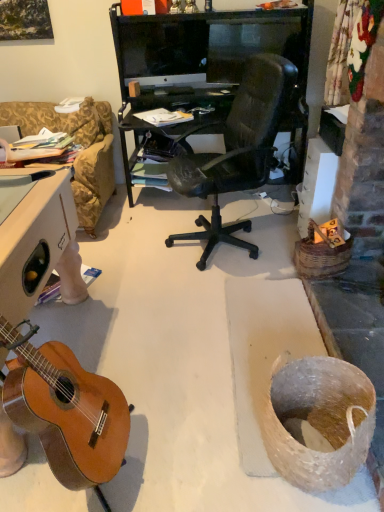
Question: From a real-world perspective, is matte black monitor at upper center on natural wood guitar at lower left?

Choices:
 (A) no
 (B) yes

Answer: (B)

Question: Does matte black monitor at upper center have a greater width compared to natural wood guitar at lower left?

Choices:
 (A) yes
 (B) no

Answer: (B)

Question: Can you confirm if matte black monitor at upper center is taller than natural wood guitar at lower left?

Choices:
 (A) yes
 (B) no

Answer: (B)

Question: Would you say matte black monitor at upper center is a long distance from natural wood guitar at lower left?

Choices:
 (A) no
 (B) yes

Answer: (B)

Question: Is the surface of matte black monitor at upper center in direct contact with natural wood guitar at lower left?

Choices:
 (A) yes
 (B) no

Answer: (B)

Question: Can we say matte black monitor at upper center lies outside natural wood guitar at lower left?

Choices:
 (A) yes
 (B) no

Answer: (A)

Question: Can you confirm if natural wood guitar at lower left is shorter than matte black monitor at upper center?

Choices:
 (A) yes
 (B) no

Answer: (B)

Question: Considering the relative sizes of natural wood guitar at lower left and matte black monitor at upper center in the image provided, is natural wood guitar at lower left bigger than matte black monitor at upper center?

Choices:
 (A) no
 (B) yes

Answer: (B)

Question: Is natural wood guitar at lower left thinner than matte black monitor at upper center?

Choices:
 (A) yes
 (B) no

Answer: (B)

Question: Is natural wood guitar at lower left oriented away from matte black monitor at upper center?

Choices:
 (A) yes
 (B) no

Answer: (B)

Question: Is natural wood guitar at lower left smaller than matte black monitor at upper center?

Choices:
 (A) no
 (B) yes

Answer: (A)

Question: From the image's perspective, is natural wood guitar at lower left located above matte black monitor at upper center?

Choices:
 (A) yes
 (B) no

Answer: (B)

Question: Is natural wood guitar at lower left taller or shorter than matte black monitor at upper center?

Choices:
 (A) short
 (B) tall

Answer: (B)